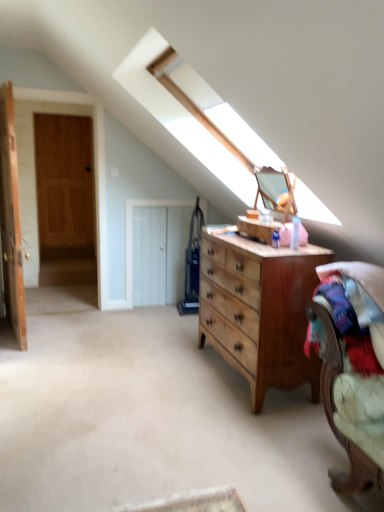
Identify the location of vacant area on top of wooden door at left, which appears as the 2th door when viewed from the right (from a real-world perspective). This screenshot has height=512, width=384. (56, 87).